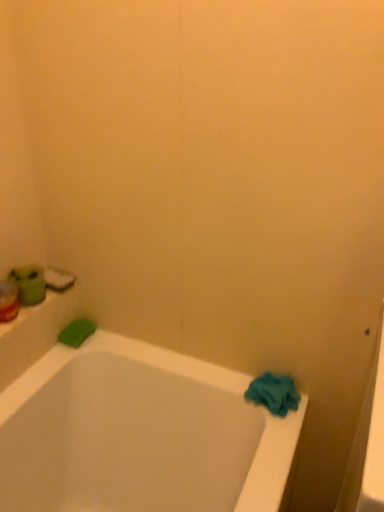
Measure the distance between teal fabric towel at lower right and camera.

teal fabric towel at lower right is 3.46 feet from camera.

The width and height of the screenshot is (384, 512). What are the coordinates of `teal fabric towel at lower right` in the screenshot? It's located at (274, 393).

Describe the element at coordinates (274, 393) in the screenshot. I see `teal fabric towel at lower right` at that location.

Identify the location of teal fabric towel at lower right. The width and height of the screenshot is (384, 512). (274, 393).